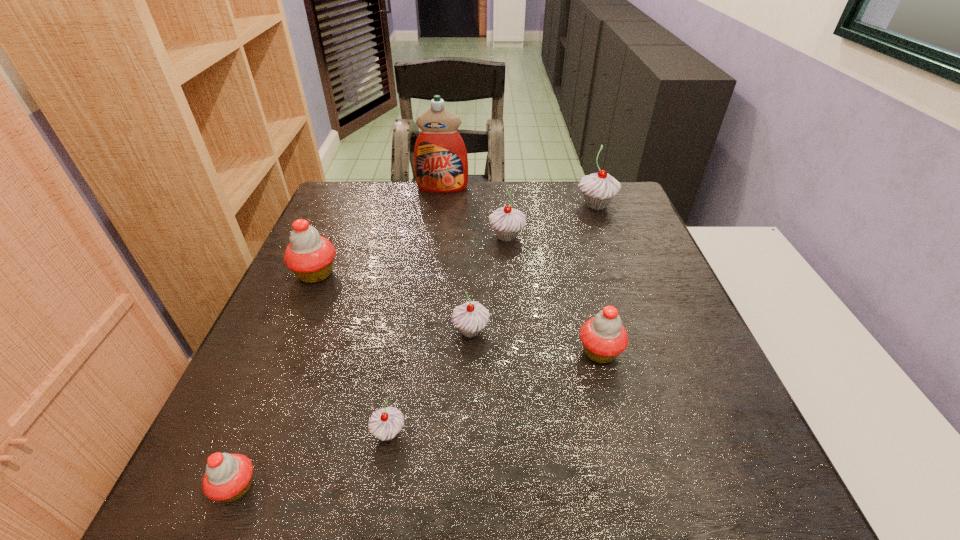
Locate an element on the screen. gray cupcake that is the second nearest to the second smallest gray cupcake is located at coordinates (507, 222).

Locate an element on the screen. This screenshot has height=540, width=960. red cupcake identified as the second closest to the second biggest red cupcake is located at coordinates (228, 477).

Image resolution: width=960 pixels, height=540 pixels. In order to click on red cupcake that stands as the third closest to the smallest gray cupcake in this screenshot , I will do `click(309, 256)`.

You are a GUI agent. You are given a task and a screenshot of the screen. Output one action in this format:
    pyautogui.click(x=<x>, y=<y>)
    Task: Click on the free space that satisfies the following two spatial constraints: 1. on the back side of the nearest red cupcake; 2. on the right side of the farthest gray cupcake
    
    Given the screenshot: What is the action you would take?
    pyautogui.click(x=351, y=205)

Find the location of a particular element. The image size is (960, 540). vacant region that satisfies the following two spatial constraints: 1. on the front surface of the third biggest gray cupcake; 2. on the right side of the tallest object is located at coordinates (424, 331).

Identify the location of vacant space that satisfies the following two spatial constraints: 1. on the back side of the second nearest cupcake; 2. on the left side of the rightmost red cupcake. (402, 352).

Identify the location of vacant space that satisfies the following two spatial constraints: 1. on the front surface of the farthest object; 2. on the left side of the second gray cupcake from right to left. (437, 237).